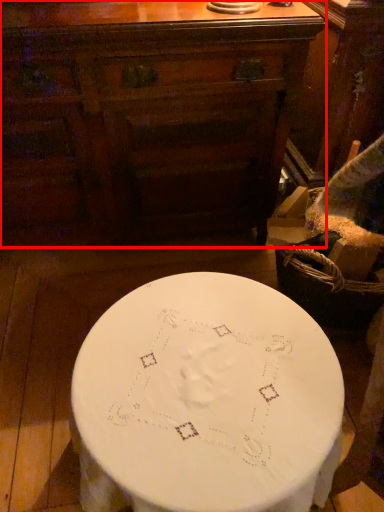
Question: From the image's perspective, what is the correct spatial positioning of chest of drawers (annotated by the red box) in reference to table?

Choices:
 (A) below
 (B) above

Answer: (B)